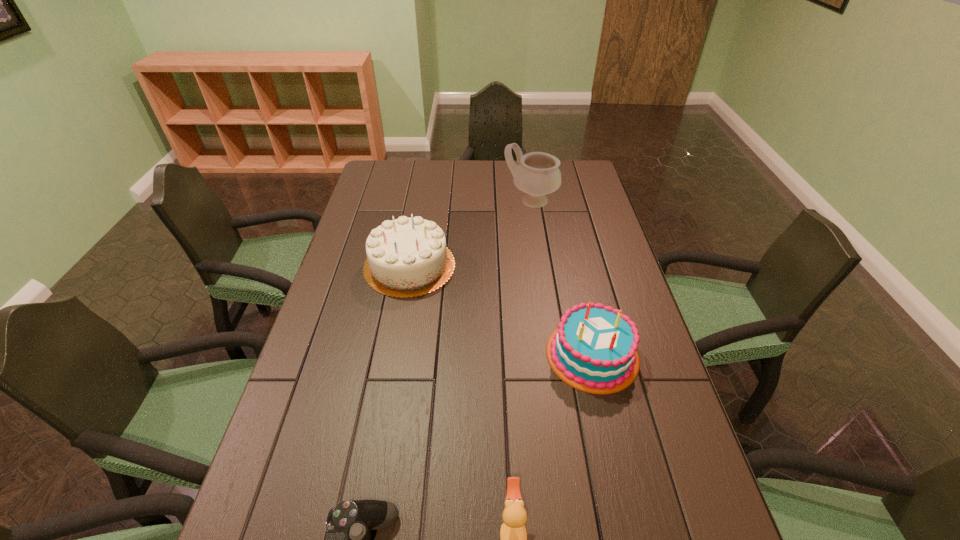
Locate an element on the screen. The height and width of the screenshot is (540, 960). vacant space in between the third nearest object and the left birthday cake is located at coordinates (501, 310).

This screenshot has width=960, height=540. Identify the location of empty space between the farther birthday cake and the third farthest object. (501, 310).

Find the location of `vacant area that lies between the farthest object and the farther birthday cake`. vacant area that lies between the farthest object and the farther birthday cake is located at coordinates (470, 233).

Image resolution: width=960 pixels, height=540 pixels. I want to click on the second closest object to the control, so tap(593, 348).

Where is `object that ranks as the fourth closest to the duck`? The image size is (960, 540). object that ranks as the fourth closest to the duck is located at coordinates (538, 174).